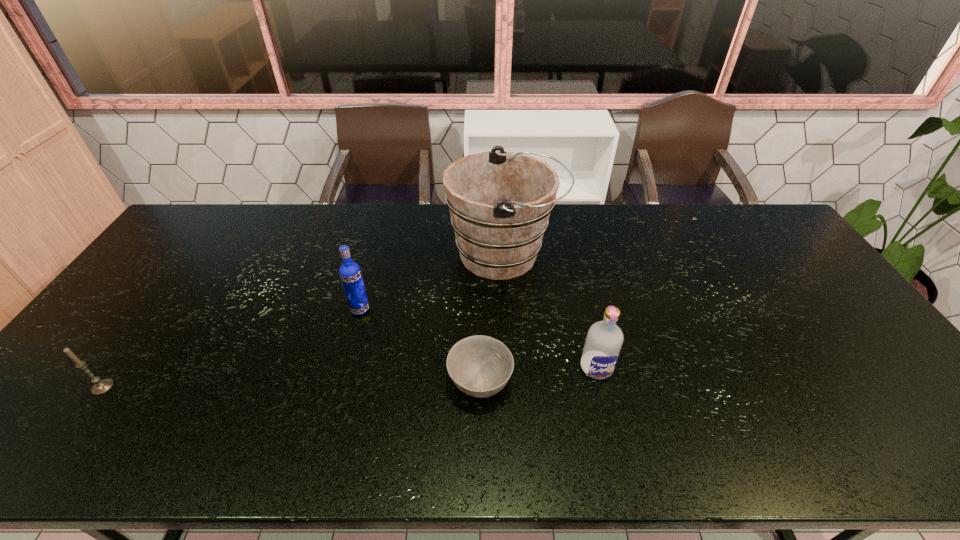
You are a GUI agent. You are given a task and a screenshot of the screen. Output one action in this format:
    pyautogui.click(x=<x>, y=<y>)
    Task: Click on the object that ranks as the fourth closest to the right vodka
    The height and width of the screenshot is (540, 960).
    Given the screenshot: What is the action you would take?
    pyautogui.click(x=100, y=386)

Identify which object is the second closest to the tallest object. Please provide its 2D coordinates. Your answer should be formatted as a tuple, i.e. [(x, y)], where the tuple contains the x and y coordinates of a point satisfying the conditions above.

[(604, 340)]